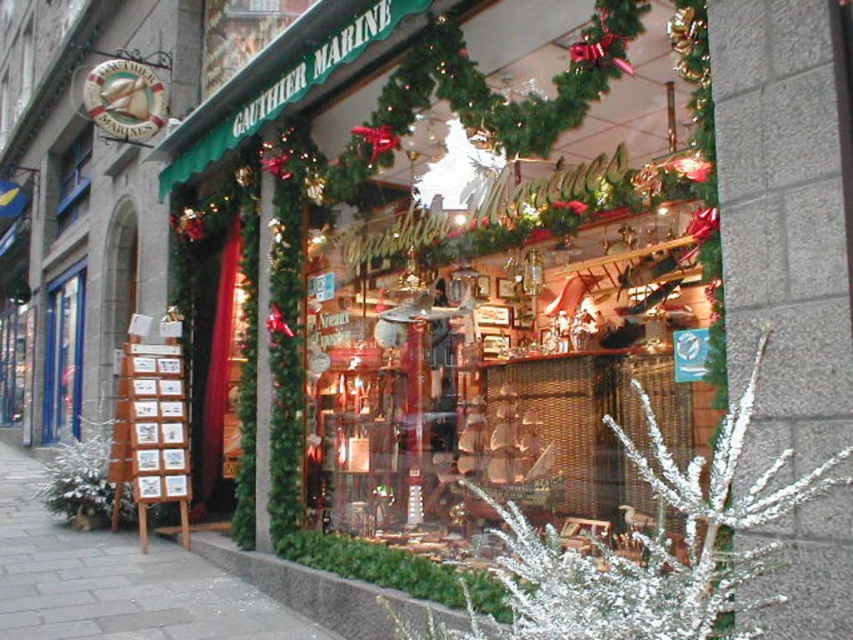
You are standing outside the shop and want to walk towards the blue glass door at left. Which direction should you move relative to the gray stone pavement at lower left?

You should move to the left relative to the gray stone pavement at lower left because the blue glass door at left is to the left of the gray stone pavement at lower left.